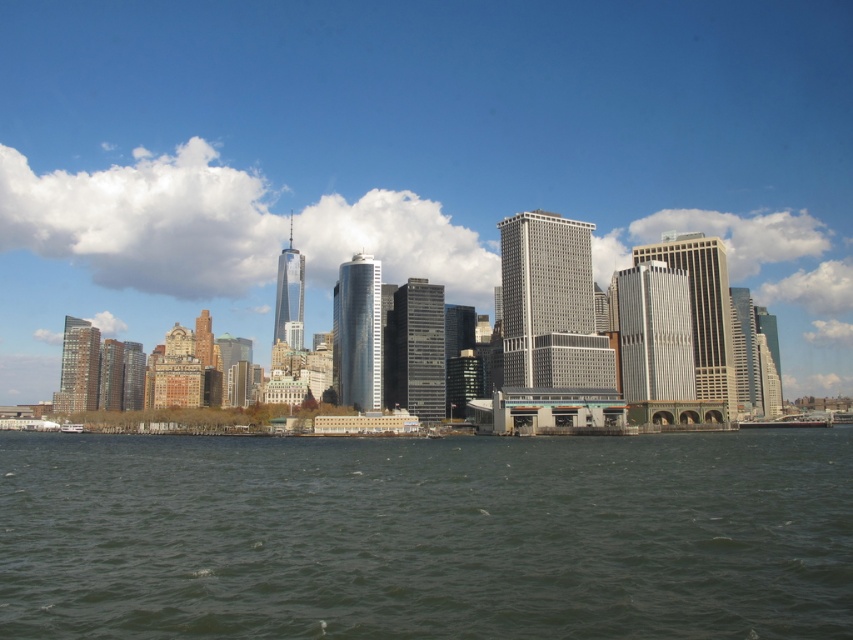
Between greenish water at lower center and white plastic boat at lower left, which one appears on the right side from the viewer's perspective?

greenish water at lower center is more to the right.

Between point (294, 634) and point (70, 420), which one is positioned behind?

Positioned behind is point (70, 420).

The height and width of the screenshot is (640, 853). In order to click on greenish water at lower center in this screenshot , I will do `click(427, 536)`.

Between point (589, 604) and point (820, 420), which one is positioned behind?

The point (820, 420) is behind.

The width and height of the screenshot is (853, 640). I want to click on greenish water at lower center, so click(427, 536).

Between transparent glass buildings at center and white plastic boat at lower left, which one is positioned lower?

white plastic boat at lower left is below.

How distant is transparent glass buildings at center from white plastic boat at lower left?

transparent glass buildings at center is 584.60 feet away from white plastic boat at lower left.

At what (x,y) coordinates should I click in order to perform the action: click on transparent glass buildings at center. Please return your answer as a coordinate pair (x, y). Looking at the image, I should click on (410, 156).